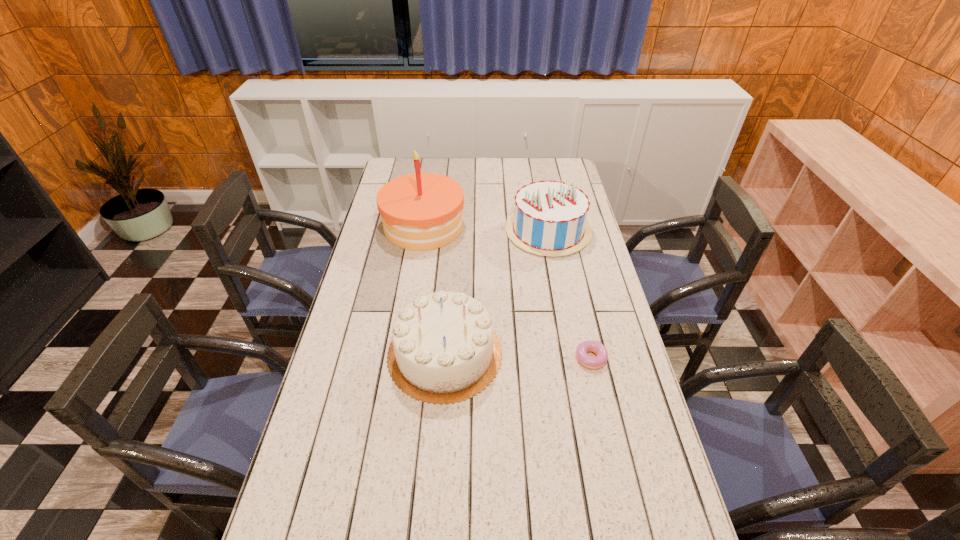
This screenshot has height=540, width=960. What are the coordinates of `doughnut located at the right edge` in the screenshot? It's located at (600, 360).

The width and height of the screenshot is (960, 540). In the image, there is a desktop. What are the coordinates of `vacant space at the left edge` in the screenshot? It's located at (388, 325).

In the image, there is a desktop. Find the location of `vacant region at the right edge`. vacant region at the right edge is located at coordinates tap(579, 331).

This screenshot has height=540, width=960. In order to click on blank region between the doughnut and the tallest object in this screenshot , I will do `click(508, 293)`.

At what (x,y) coordinates should I click in order to perform the action: click on vacant area that lies between the shortest object and the tallest object. Please return your answer as a coordinate pair (x, y). The image size is (960, 540). Looking at the image, I should click on (508, 293).

Identify the location of blank region between the rightmost birthday cake and the nearest birthday cake. (496, 292).

Find the location of a particular element. This screenshot has height=540, width=960. free point between the nearest birthday cake and the rightmost birthday cake is located at coordinates (496, 292).

Locate an element on the screen. The width and height of the screenshot is (960, 540). free spot between the rightmost birthday cake and the tallest birthday cake is located at coordinates (486, 228).

Locate an element on the screen. free spot between the shortest object and the tallest object is located at coordinates (508, 293).

Identify the location of empty space that is in between the doughnut and the rightmost birthday cake. The height and width of the screenshot is (540, 960). (569, 295).